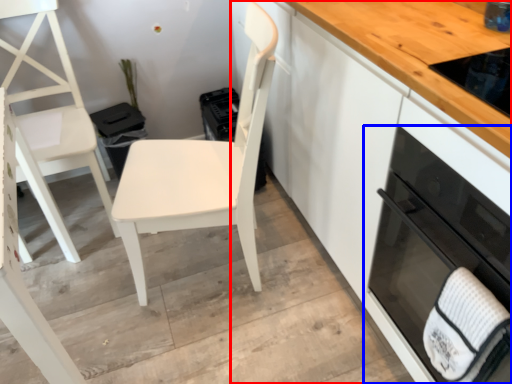
Question: Among these objects, which one is farthest to the camera, cabinetry (highlighted by a red box) or home appliance (highlighted by a blue box)?

Choices:
 (A) cabinetry
 (B) home appliance

Answer: (A)